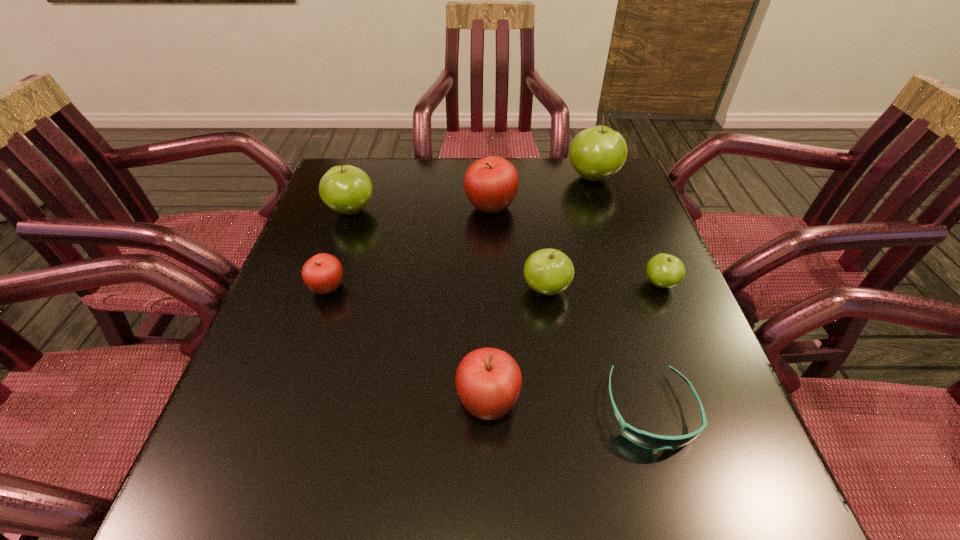
The width and height of the screenshot is (960, 540). I want to click on the smallest green apple, so click(x=664, y=270).

Find the location of a particular element. the shortest object is located at coordinates (647, 440).

Locate an element on the screen. The height and width of the screenshot is (540, 960). cyan sunglasses is located at coordinates [647, 440].

Locate an element on the screen. The image size is (960, 540). free space located on the left of the tallest object is located at coordinates (508, 178).

Where is `vacant space positioned 0.120m on the front of the farthest red apple`? The height and width of the screenshot is (540, 960). vacant space positioned 0.120m on the front of the farthest red apple is located at coordinates (492, 254).

Locate an element on the screen. The image size is (960, 540). vacant region located 0.120m on the right of the second farthest green apple is located at coordinates (420, 211).

In order to click on vacant space located on the back of the second smallest green apple in this screenshot , I will do tap(530, 178).

This screenshot has width=960, height=540. Identify the location of vacant position located on the back of the nearest apple. (487, 320).

Identify the location of vacant space located on the right of the smallest red apple. (370, 288).

Locate an element on the screen. The height and width of the screenshot is (540, 960). vacant space located on the front of the smallest green apple is located at coordinates (685, 346).